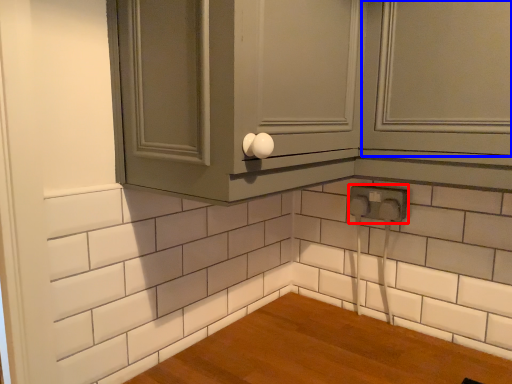
Question: Which point is closer to the camera, electric outlet (highlighted by a red box) or window (highlighted by a blue box)?

Choices:
 (A) electric outlet
 (B) window

Answer: (B)